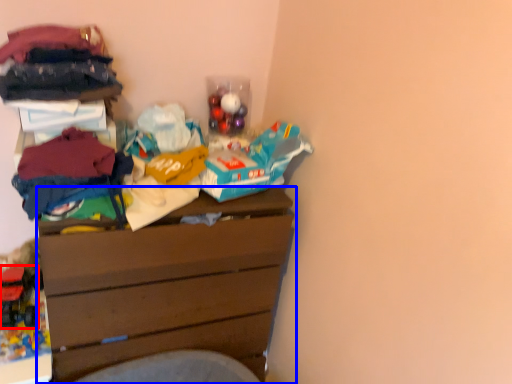
Question: Which point is further to the camera, toy (highlighted by a red box) or chest of drawers (highlighted by a blue box)?

Choices:
 (A) toy
 (B) chest of drawers

Answer: (A)